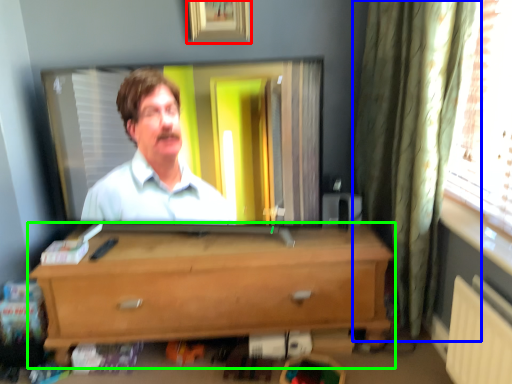
Question: Which is farther away from picture frame (highlighted by a red box)? curtain (highlighted by a blue box) or chest of drawers (highlighted by a green box)?

Choices:
 (A) curtain
 (B) chest of drawers

Answer: (B)